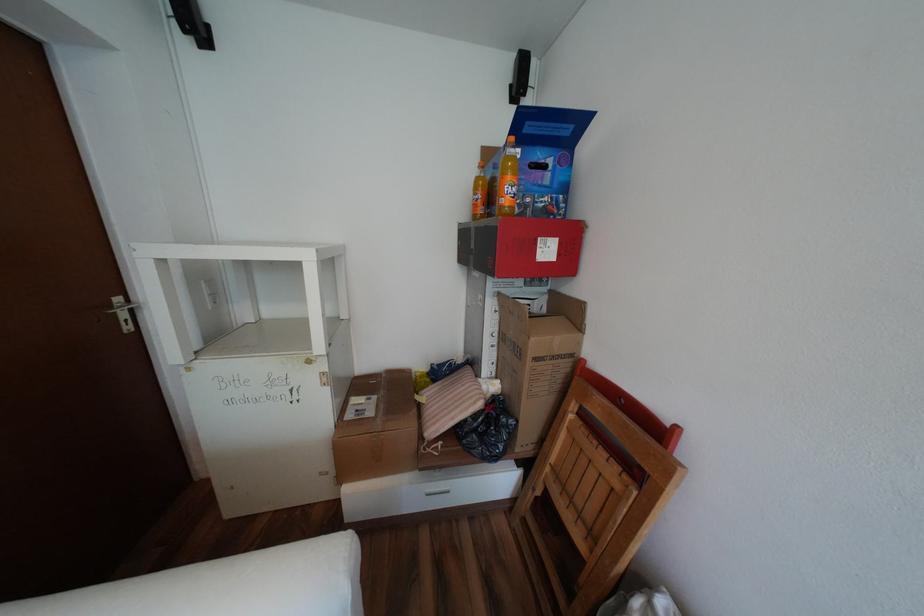
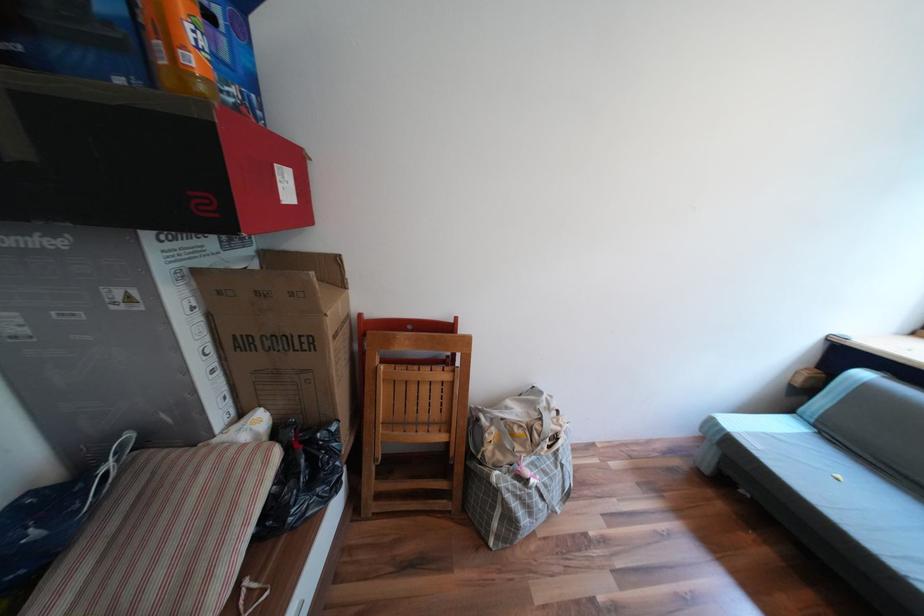
The point at (480,397) is marked in the first image. Where is the corresponding point in the second image?

(258, 464)